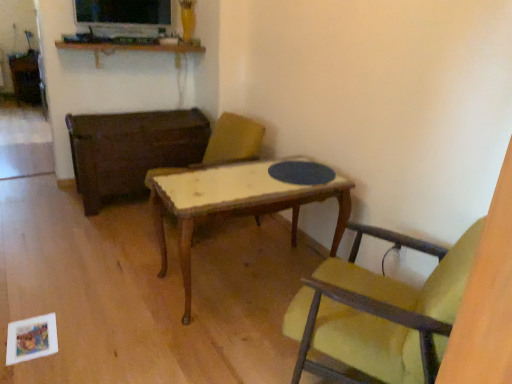
Question: Does wooden textured chair at center, the first chair in the back-to-front sequence, contain wooden shelf at upper center?

Choices:
 (A) no
 (B) yes

Answer: (A)

Question: From a real-world perspective, is wooden textured chair at center, the 2th chair in the right-to-left sequence, physically below wooden shelf at upper center?

Choices:
 (A) yes
 (B) no

Answer: (A)

Question: From the image's perspective, does wooden textured chair at center, the 2th chair in the right-to-left sequence, appear higher than wooden shelf at upper center?

Choices:
 (A) no
 (B) yes

Answer: (A)

Question: Can you confirm if wooden textured chair at center, acting as the first chair starting from the left, is shorter than wooden shelf at upper center?

Choices:
 (A) no
 (B) yes

Answer: (A)

Question: Can you confirm if wooden textured chair at center, the first chair in the back-to-front sequence, is wider than wooden shelf at upper center?

Choices:
 (A) no
 (B) yes

Answer: (B)

Question: Is the position of wooden textured chair at center, the 2th chair in the right-to-left sequence, less distant than that of wooden shelf at upper center?

Choices:
 (A) yes
 (B) no

Answer: (A)

Question: Is yellow fabric chair at center, which is the second chair in back-to-front order, placed right next to wooden shelf at upper center?

Choices:
 (A) no
 (B) yes

Answer: (A)

Question: Is yellow fabric chair at center, which appears as the 2th chair when viewed from the left, closer to the viewer compared to wooden shelf at upper center?

Choices:
 (A) no
 (B) yes

Answer: (B)

Question: Is there a large distance between yellow fabric chair at center, which is the second chair in back-to-front order, and wooden shelf at upper center?

Choices:
 (A) no
 (B) yes

Answer: (B)

Question: Is yellow fabric chair at center, which appears as the 2th chair when viewed from the left, at the right side of wooden shelf at upper center?

Choices:
 (A) yes
 (B) no

Answer: (A)

Question: Is yellow fabric chair at center, which appears as the 2th chair when viewed from the left, taller than wooden shelf at upper center?

Choices:
 (A) no
 (B) yes

Answer: (B)

Question: Is yellow fabric chair at center, acting as the 1th chair starting from the right, shorter than wooden shelf at upper center?

Choices:
 (A) yes
 (B) no

Answer: (B)

Question: Is wooden shelf at upper center not near wooden table at center?

Choices:
 (A) no
 (B) yes

Answer: (A)